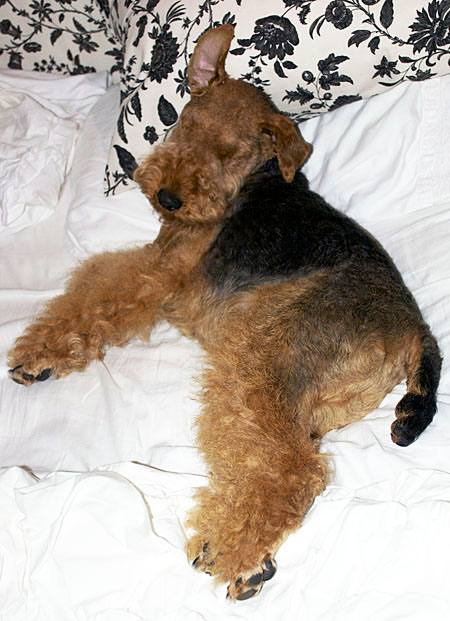
Where is `white and black pullows`? Image resolution: width=450 pixels, height=621 pixels. white and black pullows is located at coordinates (317, 42), (152, 35), (22, 38).